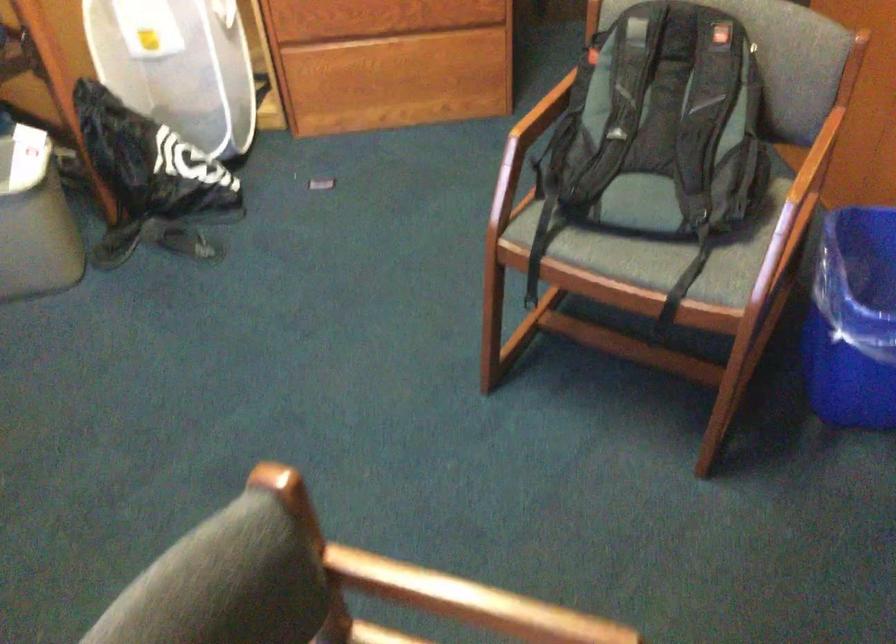
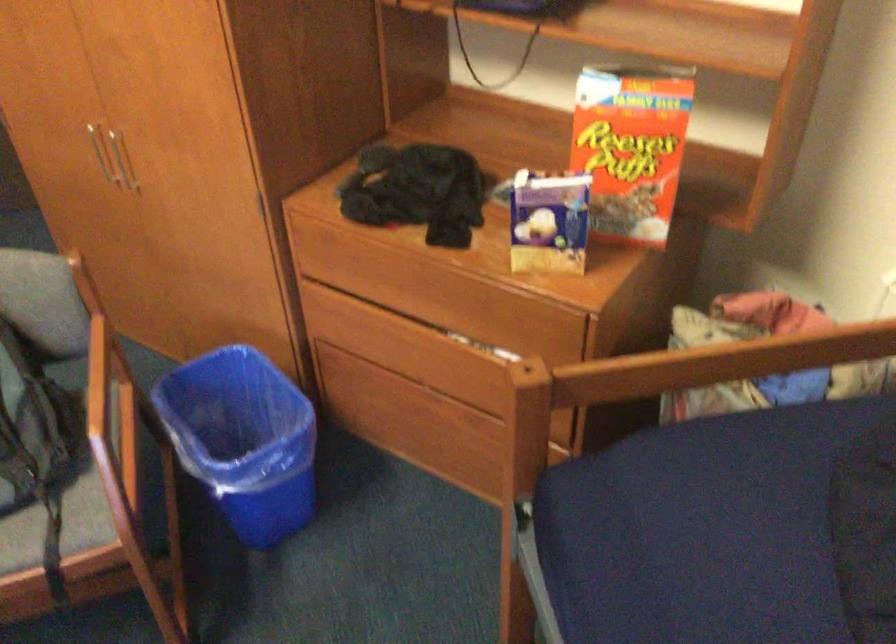
Question: The camera is either moving clockwise (left) or counter-clockwise (right) around the object. The first image is from the beginning of the video and the second image is from the end. Is the camera moving left or right when shooting the video?

Choices:
 (A) Left
 (B) Right

Answer: (A)